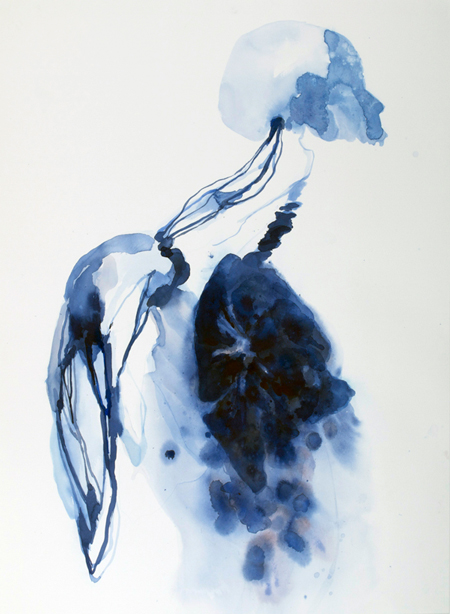
Image resolution: width=450 pixels, height=614 pixels. Identify the location of chest. (225, 356).